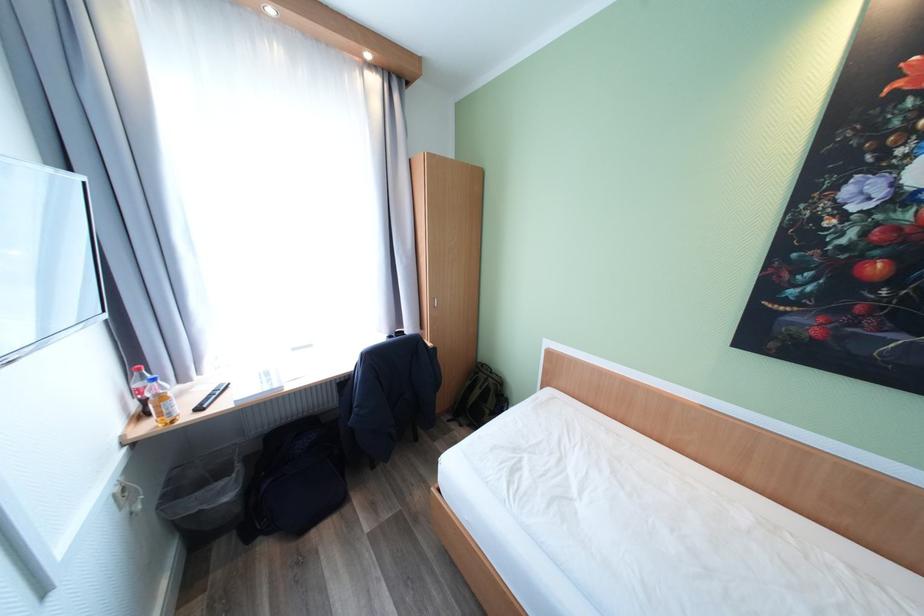
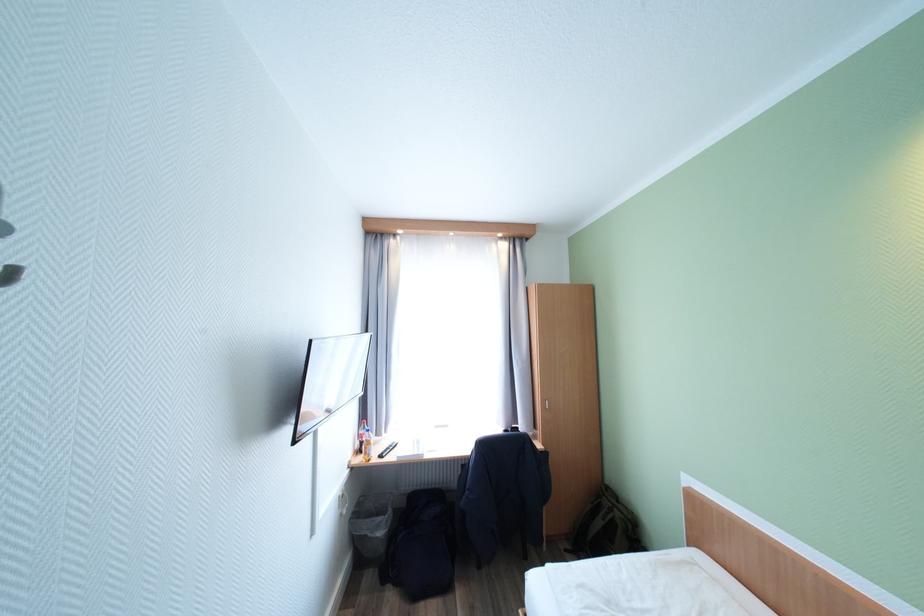
Where in the second image is the point corresponding to (359,370) from the first image?

(477, 455)